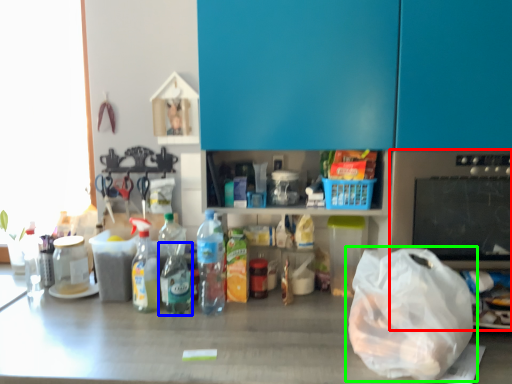
Question: Which object is the farthest from appliance (highlighted by a red box)? Choose among these: bottle (highlighted by a blue box) or plastic bag (highlighted by a green box).

Choices:
 (A) bottle
 (B) plastic bag

Answer: (A)